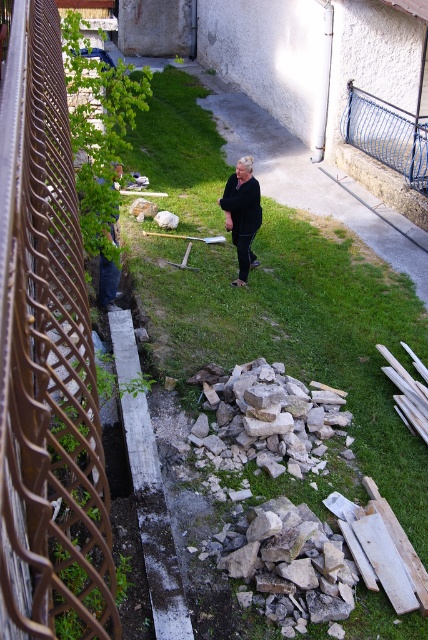
What do you see at coordinates (267, 417) in the screenshot? Image resolution: width=428 pixels, height=640 pixels. I see `gray rough stone at center` at bounding box center [267, 417].

Does gray rough stone at center appear on the left side of dark blue jeans at lower left?

Incorrect, gray rough stone at center is not on the left side of dark blue jeans at lower left.

The height and width of the screenshot is (640, 428). What do you see at coordinates (267, 417) in the screenshot?
I see `gray rough stone at center` at bounding box center [267, 417].

Image resolution: width=428 pixels, height=640 pixels. In order to click on gray rough stone at center in this screenshot , I will do `click(267, 417)`.

Between point (297, 486) and point (243, 272), which one is positioned behind?

The point (243, 272) is more distant.

Who is more forward, (213,280) or (241,248)?

Point (241,248) is more forward.

Where is `green grass at center`? The image size is (428, 640). green grass at center is located at coordinates (297, 332).

Which is more to the left, green grass at center or dark blue jeans at lower left?

Positioned to the left is dark blue jeans at lower left.

Can you confirm if green grass at center is positioned to the left of dark blue jeans at lower left?

In fact, green grass at center is to the right of dark blue jeans at lower left.

Who is more distant from viewer, (205, 356) or (101, 276)?

Result: The point (101, 276) is more distant.

This screenshot has height=640, width=428. Find the location of `green grass at center`. green grass at center is located at coordinates (297, 332).